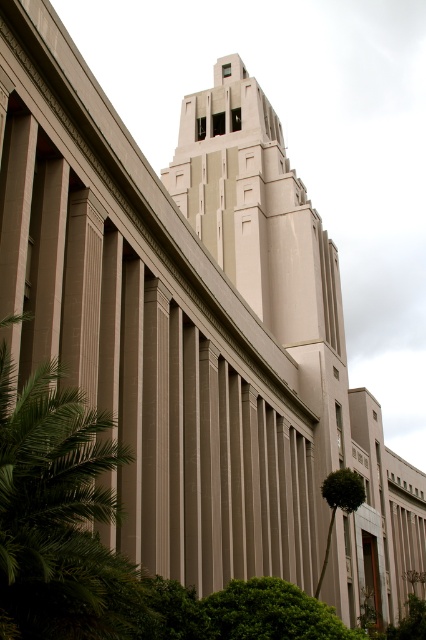
You are standing in front of the modernist building and want to take a photo that includes both green leafy palm tree at left and green leafy palm tree at lower right. Which palm tree should you position closer to the camera to ensure both are in frame?

You should position the green leafy palm tree at left closer to the camera since it is already closer to the viewer than the green leafy palm tree at lower right, ensuring both are in frame.

You are standing in front of the modernist building and notice two points on its facade. The first point is located at coordinates point (16, 529) and the second at point (331, 477). Which point is closer to your current position?

Point (16, 529) is closer to the camera than point (331, 477), so the first point is closer to your current position.